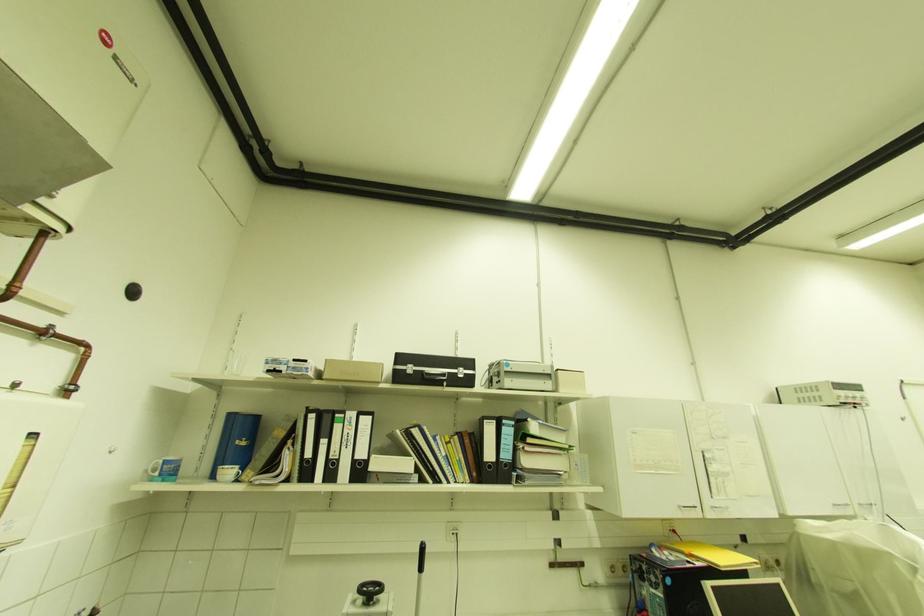
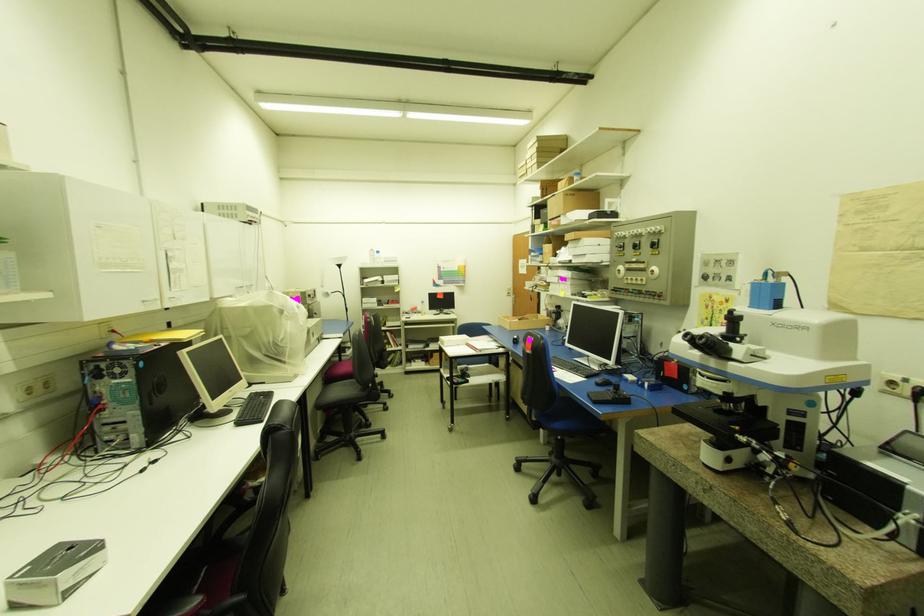
Question: The camera is either moving clockwise (left) or counter-clockwise (right) around the object. The first image is from the beginning of the video and the second image is from the end. Is the camera moving left or right when shooting the video?

Choices:
 (A) Left
 (B) Right

Answer: (A)